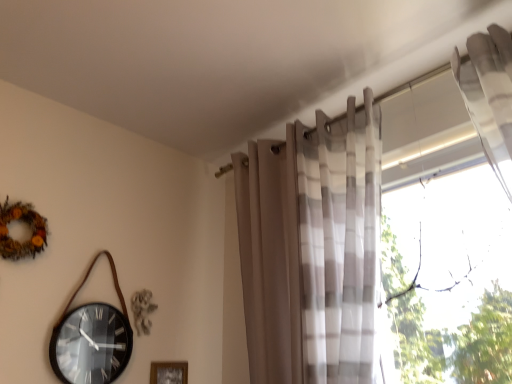
Measure the distance between point (329, 187) and camera.

Point (329, 187) and camera are 1.79 meters apart.

Locate an element on the screen. transparent glass window at right is located at coordinates pyautogui.click(x=449, y=279).

Is wooden frame at lower center thinner than transparent glass window at right?

Correct, the width of wooden frame at lower center is less than that of transparent glass window at right.

Are wooden frame at lower center and transparent glass window at right far apart?

wooden frame at lower center is positioned a significant distance from transparent glass window at right.

Is wooden frame at lower center located outside transparent glass window at right?

Yes, wooden frame at lower center is located beyond the bounds of transparent glass window at right.

Which object is wider, translucent sheer curtain at upper right or wooden frame at lower center?

translucent sheer curtain at upper right is wider.

Does point (373, 261) come behind point (158, 381)?

No, (373, 261) is closer to viewer.

From a real-world perspective, which is physically below, translucent sheer curtain at upper right or wooden frame at lower center?

From a 3D spatial view, wooden frame at lower center is below.

From a real-world perspective, is wooden frame at lower center on top of translucent sheer curtain at upper right?

No.

Relative to translucent sheer curtain at upper right, is wooden frame at lower center in front or behind?

Visually, wooden frame at lower center is located behind translucent sheer curtain at upper right.

How different are the orientations of wooden frame at lower center and translucent sheer curtain at upper right in degrees?

The angular difference between wooden frame at lower center and translucent sheer curtain at upper right is 90 degrees.

How much distance is there between wooden frame at lower center and translucent sheer curtain at upper right?

wooden frame at lower center is 34.69 inches away from translucent sheer curtain at upper right.

Is transparent glass window at right bigger or smaller than wooden frame at lower center?

Considering their sizes, transparent glass window at right takes up more space than wooden frame at lower center.

Which of these two, transparent glass window at right or wooden frame at lower center, is thinner?

wooden frame at lower center is thinner.

Which is more to the right, transparent glass window at right or wooden frame at lower center?

transparent glass window at right is more to the right.

Which is behind, point (329, 193) or point (452, 214)?

Point (329, 193)

Is the depth of translucent sheer curtain at upper right less than that of transparent glass window at right?

No, translucent sheer curtain at upper right is further to the viewer.

Does translucent sheer curtain at upper right contain transparent glass window at right?

No, transparent glass window at right is not a part of translucent sheer curtain at upper right.

Can you confirm if translucent sheer curtain at upper right is bigger than transparent glass window at right?

Indeed, translucent sheer curtain at upper right has a larger size compared to transparent glass window at right.

Does transparent glass window at right turn towards translucent sheer curtain at upper right?

No, transparent glass window at right is not oriented towards translucent sheer curtain at upper right.

Is point (469, 267) more distant than point (292, 340)?

No, it is not.

From the image's perspective, which one is positioned higher, transparent glass window at right or translucent sheer curtain at upper right?

translucent sheer curtain at upper right.

From the picture: Can you confirm if transparent glass window at right is wider than translucent sheer curtain at upper right?

In fact, transparent glass window at right might be narrower than translucent sheer curtain at upper right.

Where is `window that appears above the wooden frame at lower center (from the image's perspective)`? This screenshot has width=512, height=384. window that appears above the wooden frame at lower center (from the image's perspective) is located at coordinates (449, 279).

This screenshot has height=384, width=512. I want to click on picture frame behind the translucent sheer curtain at upper right, so click(169, 372).

Estimate the real-world distances between objects in this image. Which object is closer to wooden frame at lower center, transparent glass window at right or translucent sheer curtain at upper right?

translucent sheer curtain at upper right lies closer to wooden frame at lower center than the other object.

Considering their positions, is translucent sheer curtain at upper right positioned closer to transparent glass window at right than wooden frame at lower center?

Among the two, translucent sheer curtain at upper right is located nearer to transparent glass window at right.

Consider the image. Considering their positions, is wooden frame at lower center positioned closer to translucent sheer curtain at upper right than transparent glass window at right?

transparent glass window at right.

Based on their spatial positions, is transparent glass window at right or wooden frame at lower center further from translucent sheer curtain at upper right?

The object further to translucent sheer curtain at upper right is wooden frame at lower center.

Considering their positions, is translucent sheer curtain at upper right positioned closer to wooden frame at lower center than transparent glass window at right?

translucent sheer curtain at upper right is positioned closer to the anchor wooden frame at lower center.

Looking at the image, which one is located further to transparent glass window at right, wooden frame at lower center or translucent sheer curtain at upper right?

wooden frame at lower center is further to transparent glass window at right.

What are the coordinates of `curtain between wooden frame at lower center and transparent glass window at right from left to right` in the screenshot? It's located at (312, 250).